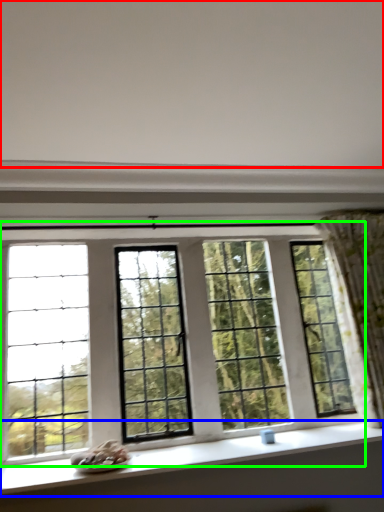
Question: Which is farther away from backdrop (highlighted by a red box)? window sill (highlighted by a blue box) or window (highlighted by a green box)?

Choices:
 (A) window sill
 (B) window

Answer: (A)